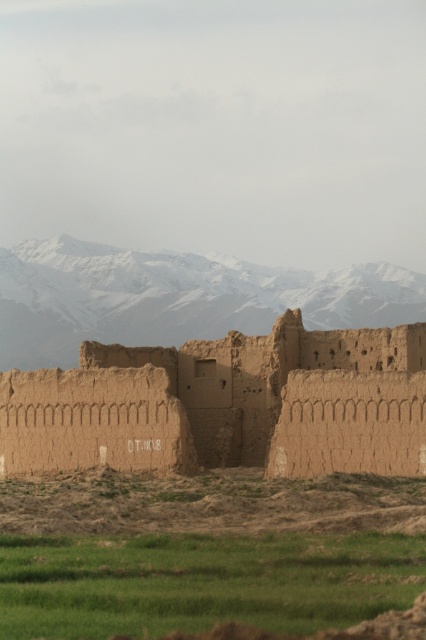
You are standing in front of the ancient mud brick structure and want to walk towards the snowy rock mountain range at upper center. Which direction should you move relative to the green grass at lower center?

You should move to the right relative to the green grass at lower center because the snowy rock mountain range at upper center is to the right of the green grass at lower center.